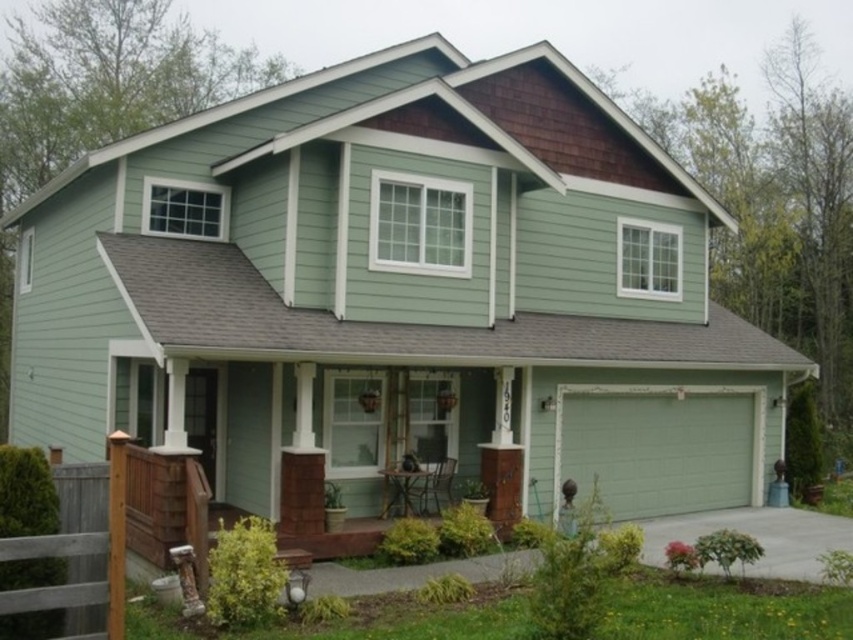
You are a delivery person trying to park your van next to the green smooth garage door at lower right and the brown wooden fence at lower left. Based on their widths, which side should you park on to ensure enough space?

The green smooth garage door at lower right is wider than the brown wooden fence at lower left, so you should park on the side of the brown wooden fence at lower left to have enough space.

You are standing at the front door of the house and want to park your car in the garage. Based on the coordinates provided, is the green smooth garage door at lower right located to your left or right side when facing the house?

The green smooth garage door at lower right is located at coordinates point (x=660, y=445), which places it to the right side when facing the house.

Consider the image. You are standing in front of the house and want to walk towards the brown wooden fence at lower left. Which direction should you move relative to the green smooth garage door at lower right?

The brown wooden fence at lower left is behind the green smooth garage door at lower right, so you should move behind the green smooth garage door at lower right to reach the brown wooden fence at lower left.